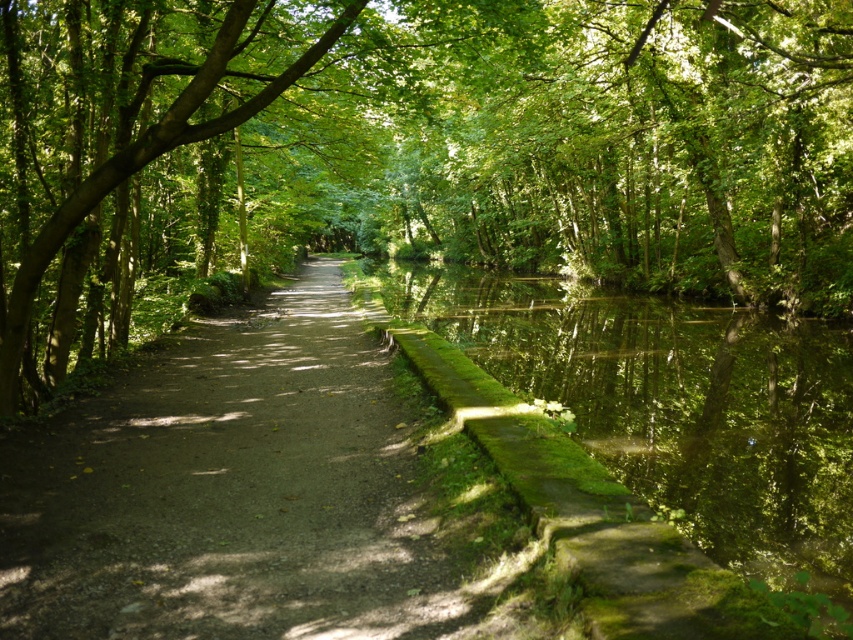
Question: Can you confirm if green leafy tree at center is positioned to the left of dirt path at center?

Choices:
 (A) yes
 (B) no

Answer: (B)

Question: Does green leafy tree at center lie in front of dirt path at center?

Choices:
 (A) no
 (B) yes

Answer: (B)

Question: Which point is farther to the camera?

Choices:
 (A) green leafy tree at center
 (B) dirt path at center

Answer: (B)

Question: Which of the following is the farthest from the observer?

Choices:
 (A) dirt path at center
 (B) green leafy tree at center

Answer: (A)

Question: Among these points, which one is nearest to the camera?

Choices:
 (A) (659, 115)
 (B) (90, 422)

Answer: (B)

Question: Does green leafy tree at center have a smaller size compared to dirt path at center?

Choices:
 (A) yes
 (B) no

Answer: (B)